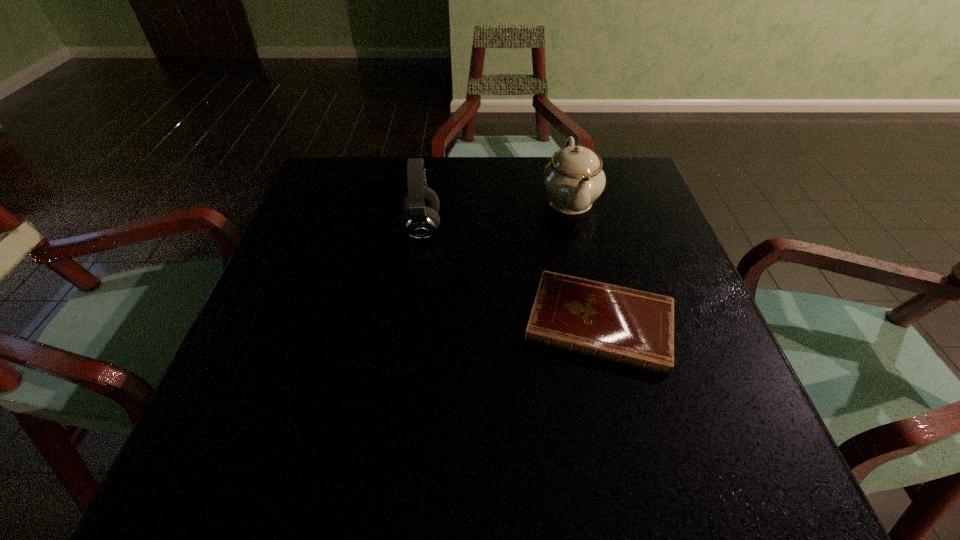
You are a GUI agent. You are given a task and a screenshot of the screen. Output one action in this format:
    pyautogui.click(x=<x>, y=<y>)
    Task: Click on the object that is the second closest one to the notebook
    
    Given the screenshot: What is the action you would take?
    pyautogui.click(x=420, y=219)

The width and height of the screenshot is (960, 540). I want to click on vacant area in the image that satisfies the following two spatial constraints: 1. at the spout of the chinaware; 2. on the ear cups of the leftmost object, so click(x=576, y=228).

At what (x,y) coordinates should I click in order to perform the action: click on vacant region that satisfies the following two spatial constraints: 1. on the ear cups of the headset; 2. on the right side of the notebook. Please return your answer as a coordinate pair (x, y). This screenshot has height=540, width=960. Looking at the image, I should click on (409, 323).

You are a GUI agent. You are given a task and a screenshot of the screen. Output one action in this format:
    pyautogui.click(x=<x>, y=<y>)
    Task: Click on the blank area in the image that satisfies the following two spatial constraints: 1. at the spout of the nearest object; 2. on the right side of the chinaware
    The width and height of the screenshot is (960, 540).
    Given the screenshot: What is the action you would take?
    pyautogui.click(x=598, y=323)

Where is `vacant space that satisfies the following two spatial constraints: 1. at the spout of the notebook; 2. on the right side of the chinaware`? vacant space that satisfies the following two spatial constraints: 1. at the spout of the notebook; 2. on the right side of the chinaware is located at coordinates (598, 323).

The width and height of the screenshot is (960, 540). Identify the location of vacant area in the image that satisfies the following two spatial constraints: 1. on the back side of the shortest object; 2. on the ear cups of the headset. (577, 228).

The width and height of the screenshot is (960, 540). Find the location of `vacant area in the image that satisfies the following two spatial constraints: 1. at the spout of the chinaware; 2. on the ear cups of the leftmost object`. vacant area in the image that satisfies the following two spatial constraints: 1. at the spout of the chinaware; 2. on the ear cups of the leftmost object is located at coordinates (576, 228).

I want to click on vacant space that satisfies the following two spatial constraints: 1. on the ear cups of the nearest object; 2. on the left side of the headset, so click(409, 323).

At what (x,y) coordinates should I click in order to perform the action: click on vacant space that satisfies the following two spatial constraints: 1. at the spout of the chinaware; 2. on the ear cups of the leftmost object. Please return your answer as a coordinate pair (x, y). The width and height of the screenshot is (960, 540). Looking at the image, I should click on (576, 228).

The image size is (960, 540). Find the location of `vacant area that satisfies the following two spatial constraints: 1. on the ear cups of the notebook; 2. on the right side of the headset`. vacant area that satisfies the following two spatial constraints: 1. on the ear cups of the notebook; 2. on the right side of the headset is located at coordinates (409, 323).